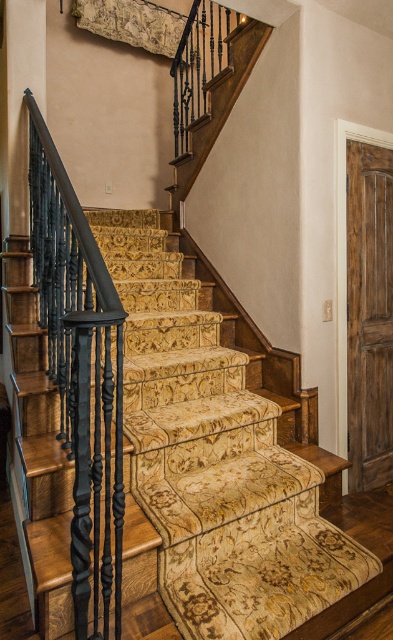
Based on the photo, you are a delivery person carrying a package and need to go through the space between the carpeted stairs at center and the rustic wood door at right. The package is 2 meters in height. Can you pass through without tilting it?

The carpeted stairs at center is shorter than rustic wood door at right, so the height available is determined by the shorter object, which is the carpeted stairs at center. Since the package is 2 meters tall, you need to check if the height of the carpeted stairs at center allows passage. However, the exact height isn not provided, so we can not definitively answer if the package can pass through without tilting.

You are an interior designer assessing the space between the black wrought iron railing at left and rustic wood door at right. Which object is taller?

The black wrought iron railing at left is taller than the rustic wood door at right.

You are a painter holding a 17 inch wide paint roller. You need to move along the space between the carpeted stairs at center and the black wrought iron railing at left. Can you fit through that space without bending or tilting the paint roller?

The distance between the carpeted stairs at center and the black wrought iron railing at left is 16.78 inches. Since the paint roller is 17 inches wide, it is slightly wider than the available space. Therefore, you cannot fit through that space without adjusting the position of the paint roller.